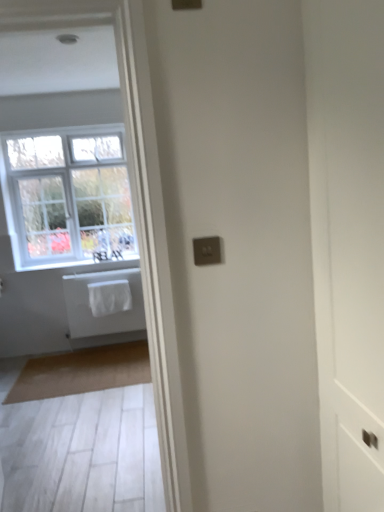
This screenshot has height=512, width=384. Identify the location of vacant point above white fabric at lower left (from a real-world perspective). (59, 260).